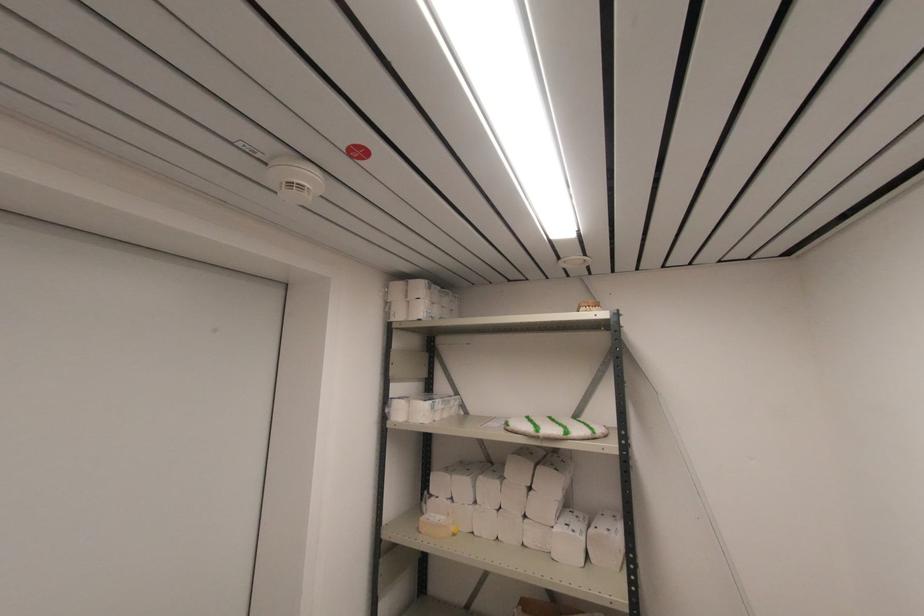
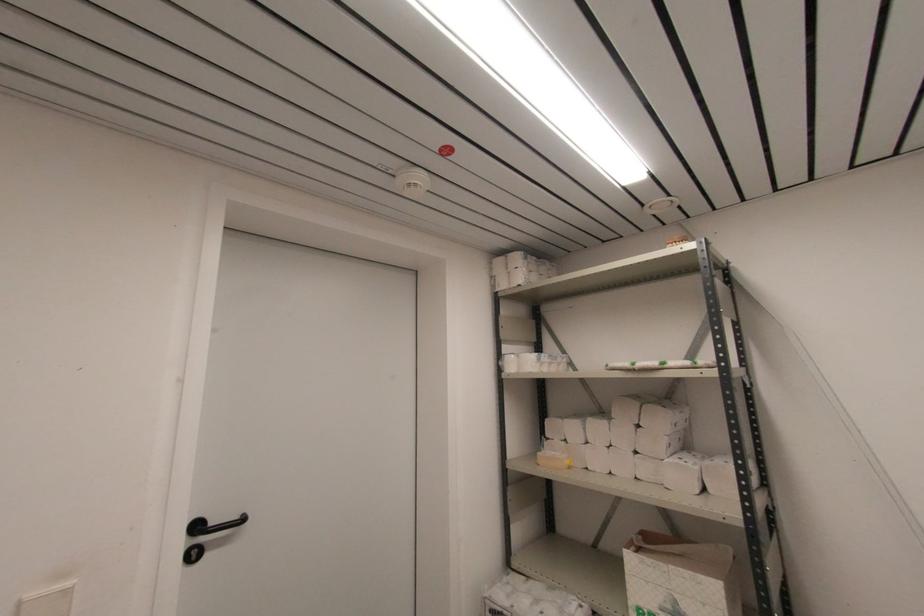
Locate, in the second image, the point that corresponds to point 526,517 in the first image.

(637, 453)